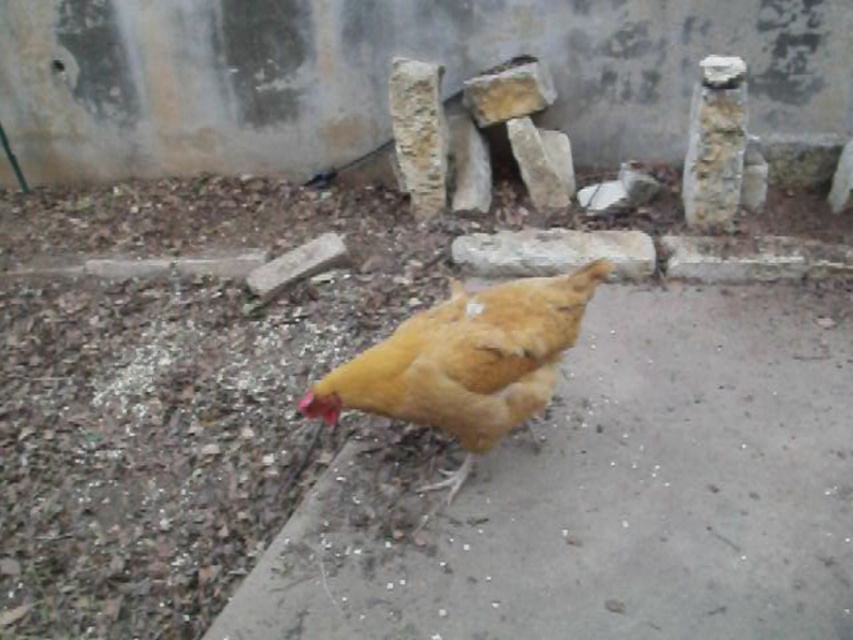
You are standing at the origin point of the image coordinate system, which is the bottom left corner. You want to locate the yellow feathered chicken at center. Which direction should you move from the origin point to reach point (602, 493) where the chicken is located?

To reach point (602, 493) from the origin at the bottom left corner, you should move mostly to the right and slightly upwards, as the x coordinate 0.773 indicates a position far to the right and the y coordinate 0.707 suggests a position above the middle of the image vertically.

You are observing a scene with a yellow feathered chicken at center and a rough stone at center. Which object occupies more space in the image?

The yellow feathered chicken at center is bigger than the rough stone at center, so it occupies more space in the image.